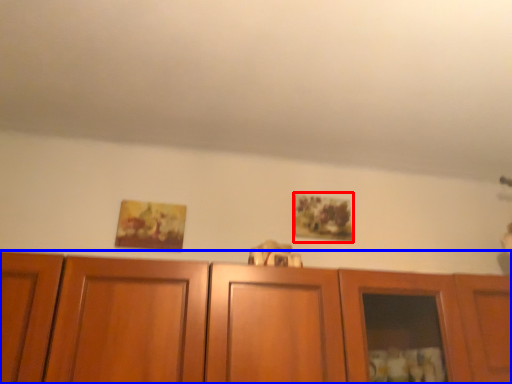
Question: Which object appears closest to the camera in this image, picture frame (highlighted by a red box) or cabinetry (highlighted by a blue box)?

Choices:
 (A) picture frame
 (B) cabinetry

Answer: (B)